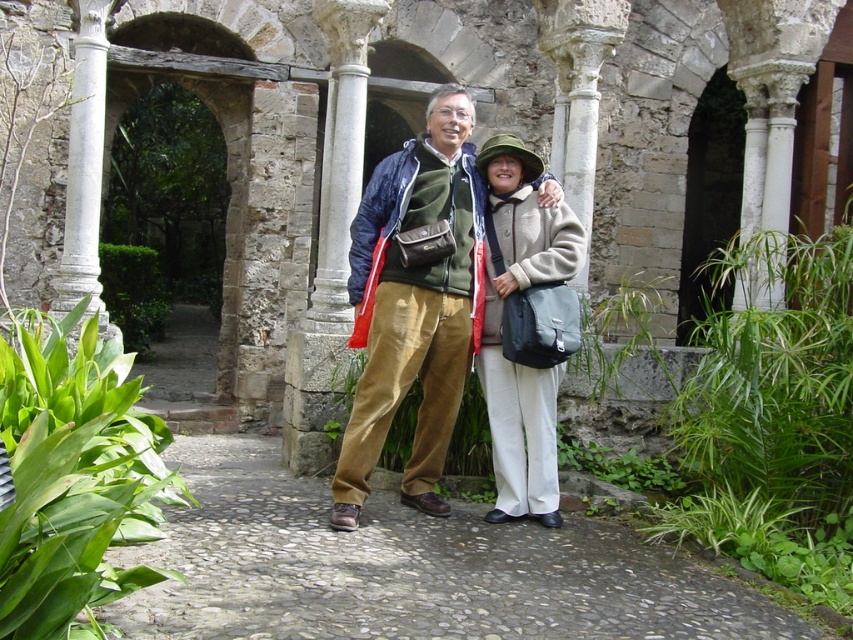
You are standing in the courtyard and want to walk towards the entrance of the structure. You notice two points marked in the image. The first point is at coordinates point (x=238, y=566) and the second is at point (x=352, y=474). Which point should you head towards to reach the entrance more quickly?

Point (x=238, y=566) is in front of point (x=352, y=474), so heading towards point (x=238, y=566) would lead you closer to the entrance more quickly.

You are a photographer trying to capture both the matte green jacket at center and the light beige wool coat at center in a single frame. Since you want to emphasize the height difference between them, which jacket should you position closer to the camera to make it appear taller?

The matte green jacket at center is taller than the light beige wool coat at center. To emphasize its height difference, position the matte green jacket at center closer to the camera so it appears even taller in the photo.

You are standing at the point labeled as point (410, 570) in the image. Looking around, you see a gray cobblestone path at center. Which direction should you walk to reach the historical stone structure in the background?

The gray cobblestone path at center leads directly to the historical stone structure in the background, so you should walk forward along the path.